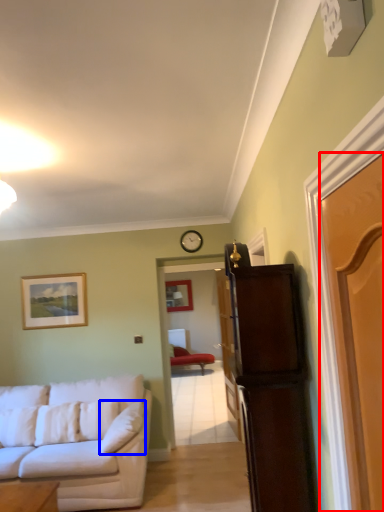
Question: Which point is closer to the camera, door (highlighted by a red box) or pillow (highlighted by a blue box)?

Choices:
 (A) door
 (B) pillow

Answer: (A)